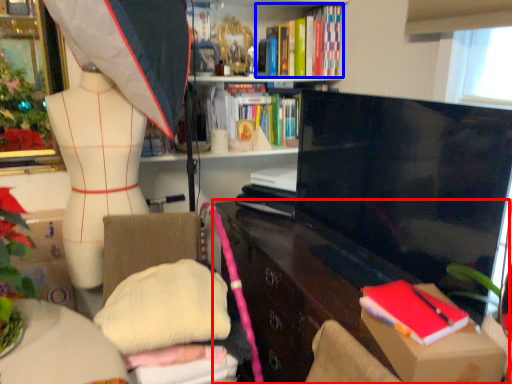
Question: Which object appears farthest to the camera in this image, cabinetry (highlighted by a red box) or book (highlighted by a blue box)?

Choices:
 (A) cabinetry
 (B) book

Answer: (B)